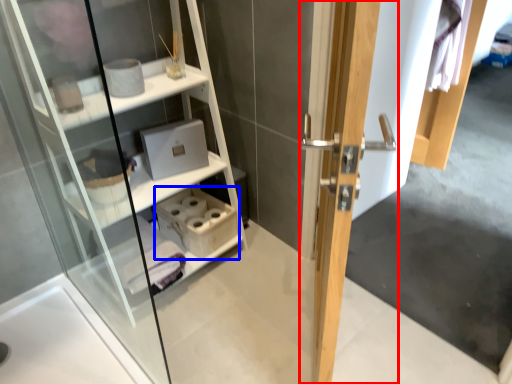
Question: Which point is further to the camera, door (highlighted by a red box) or cabinet (highlighted by a blue box)?

Choices:
 (A) door
 (B) cabinet

Answer: (B)